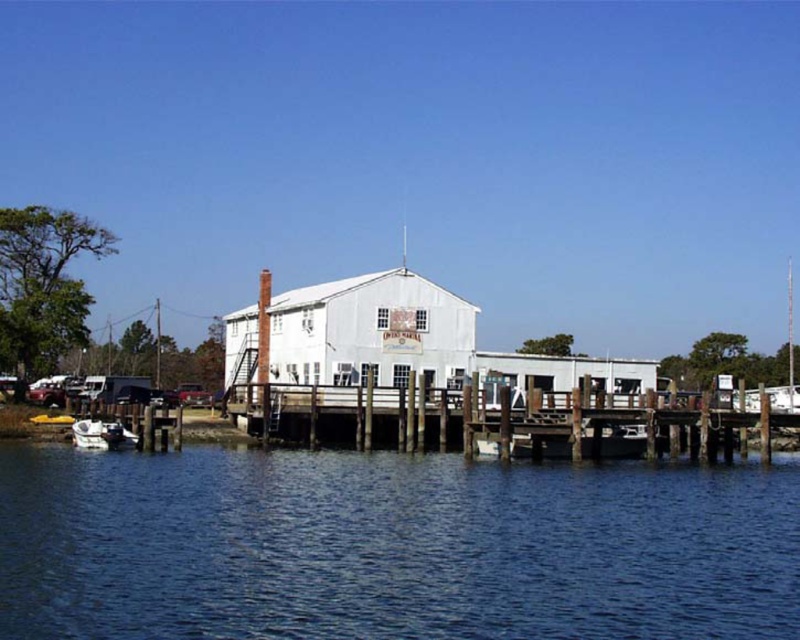
You are standing at the waterfront and see the wooden at center and the metallic red car at lower left. Which object is closer to you?

The wooden at center is closer to you because it is in front of the metallic red car at lower left.

You are standing on the wooden pier at Owens Marina and want to walk from point A to point B. Point A is located at coordinate point (242, 396) and point B is at coordinate point (92, 426). Since you want to move towards the water, which direction should you walk from point A to reach point B?

To move towards the water from point A at coordinate point (242, 396) to point B at coordinate point (92, 426), you should walk downward because point A is further to the camera than point B, meaning point B is closer to the water.

You are standing at the entrance of the Owens Marina building on the pier. You need to walk to a specific location marked by point (74,444). However, there is an obstacle at point (178,388). Will you be able to reach your destination without going around the obstacle?

Point (74,444) is in front of point (178,388), so you can reach the destination without going around the obstacle because it is closer to you than the obstacle.